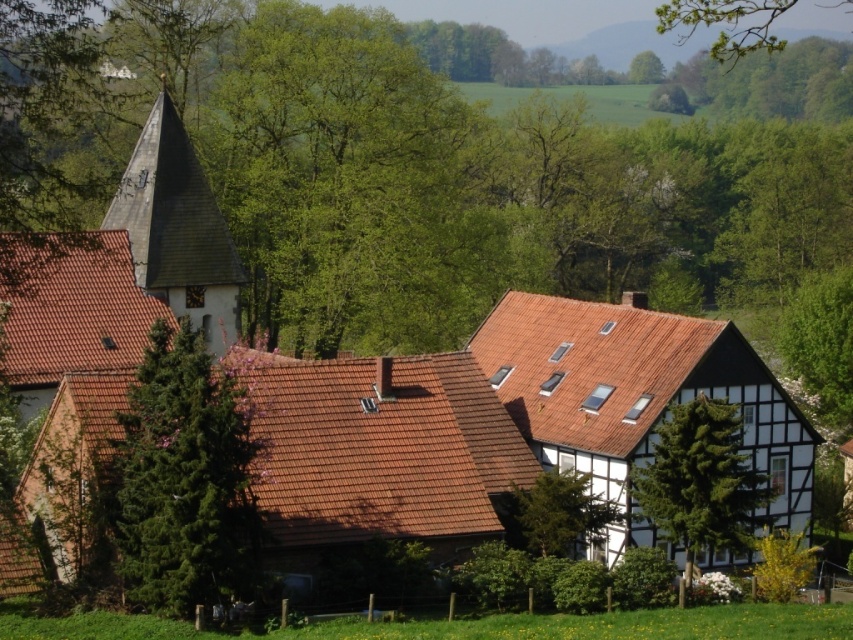
Does green textured tree at center appear over green leafy tree at center?

No, green textured tree at center is not above green leafy tree at center.

Between point (688, 579) and point (576, 504), which one is positioned behind?

The point (576, 504) is more distant.

Where is `green textured tree at center`? The image size is (853, 640). green textured tree at center is located at coordinates (701, 481).

Identify the location of green textured tree at center. (701, 481).

How distant is green textured tree at center from green leafy tree at upper right?

green textured tree at center is 108.99 feet away from green leafy tree at upper right.

Does green textured tree at center lie in front of green leafy tree at upper right?

Yes.

Which is in front, point (762, 493) or point (836, 353)?

Positioned in front is point (762, 493).

The width and height of the screenshot is (853, 640). What are the coordinates of `green textured tree at center` in the screenshot? It's located at (701, 481).

Is the position of matte brown steeple at left less distant than that of green textured tree at center?

Yes, it is in front of green textured tree at center.

Which is more to the right, matte brown steeple at left or green textured tree at center?

From the viewer's perspective, green textured tree at center appears more on the right side.

In order to click on matte brown steeple at left in this screenshot , I will do `click(120, 273)`.